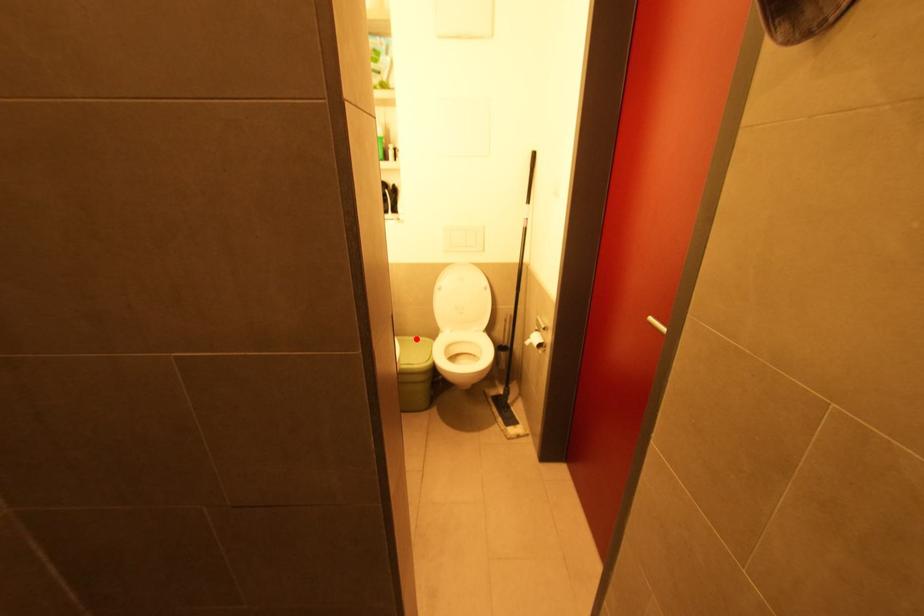
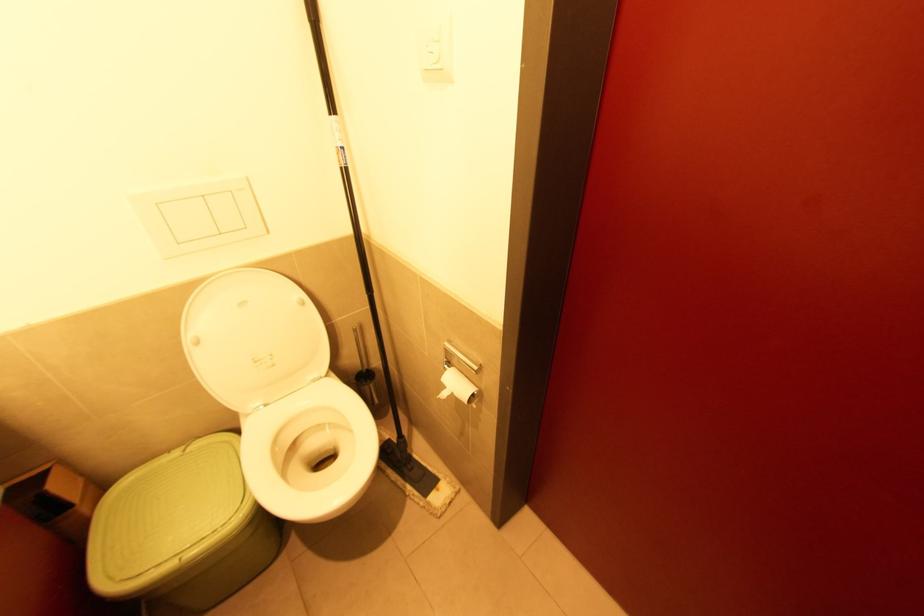
Question: I am providing you with two images of the same scene from different viewpoints. In image1, a red point is highlighted. Considering the same 3D point in image2, which of the following is correct?

Choices:
 (A) It is closer
 (B) It is farther

Answer: (A)